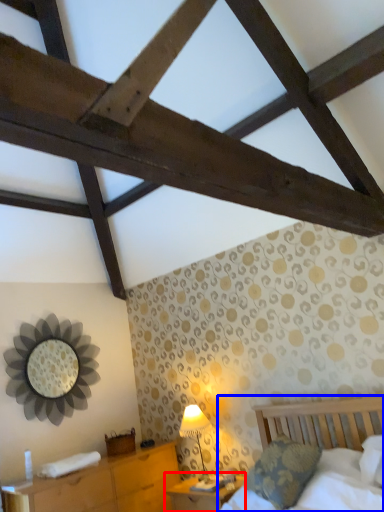
Question: Which object appears closest to the camera in this image, nightstand (highlighted by a red box) or bed (highlighted by a blue box)?

Choices:
 (A) nightstand
 (B) bed

Answer: (B)